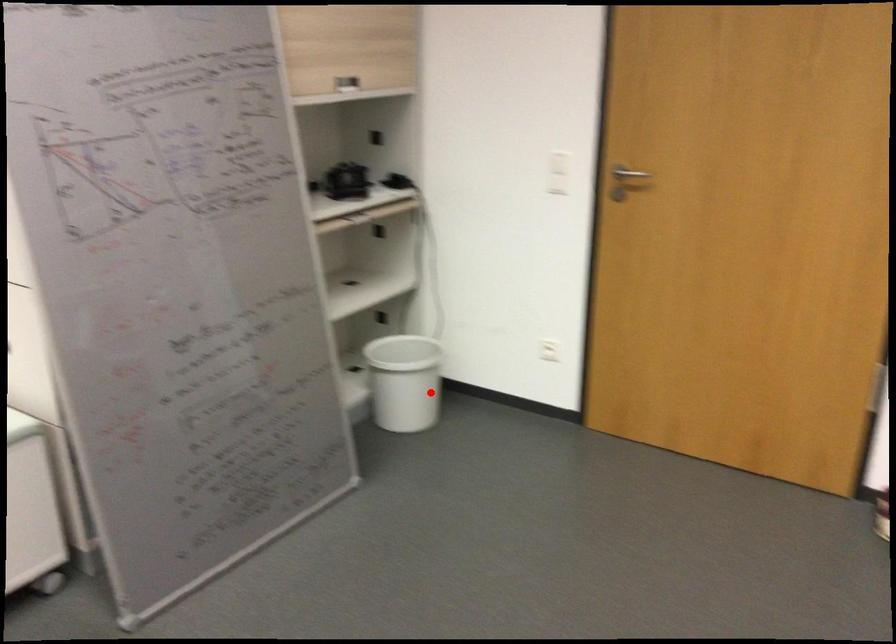
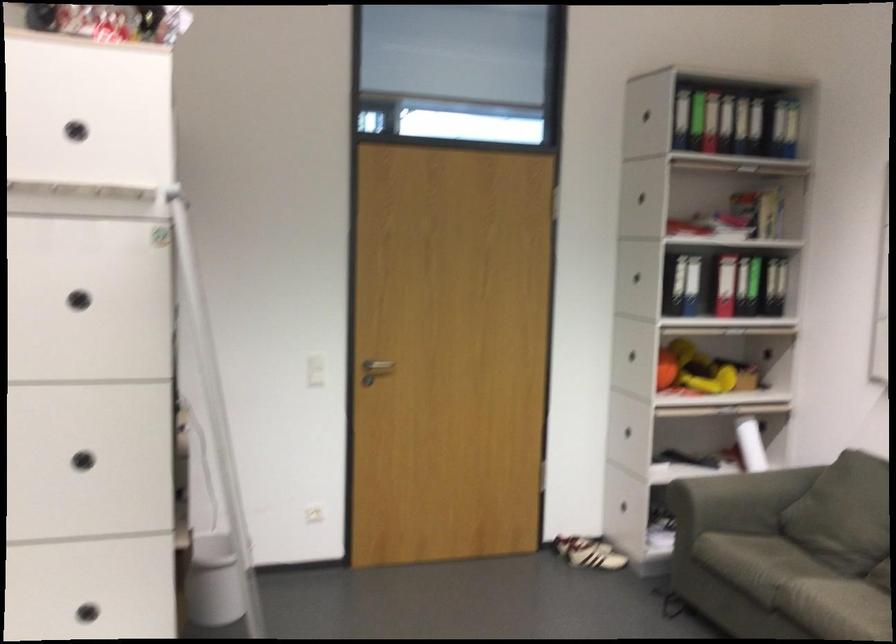
The point at the highlighted location is marked in the first image. Where is the corresponding point in the second image?

(213, 581)